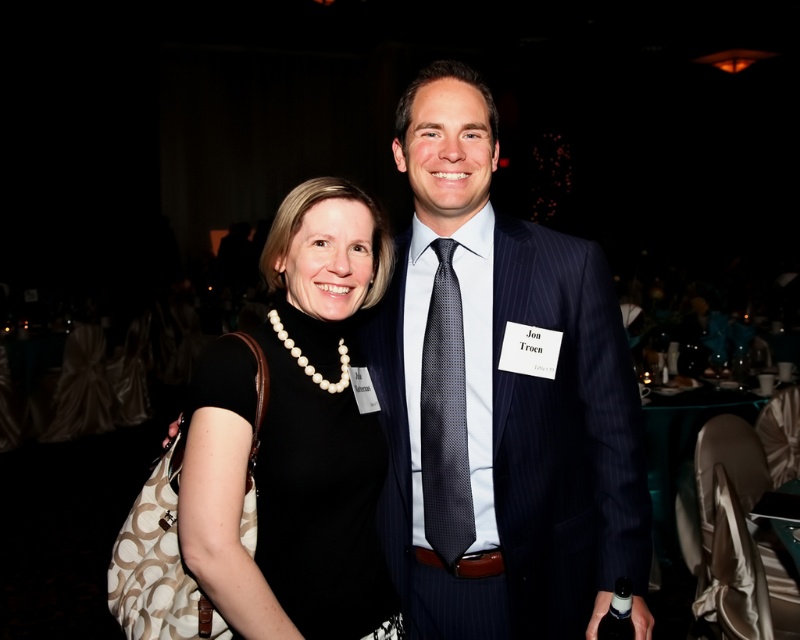
Can you confirm if black matte dress at center is bigger than black dotted tie at center?

Correct, black matte dress at center is larger in size than black dotted tie at center.

Who is higher up, black matte dress at center or black dotted tie at center?

black matte dress at center

Between point (266, 273) and point (444, 371), which one is positioned behind?

Positioned behind is point (444, 371).

Where is `black matte dress at center`? black matte dress at center is located at coordinates (296, 436).

Is dark blue pinstripe suit at center closer to camera compared to black matte dress at center?

No, dark blue pinstripe suit at center is behind black matte dress at center.

Does dark blue pinstripe suit at center appear on the left side of black matte dress at center?

In fact, dark blue pinstripe suit at center is to the right of black matte dress at center.

Is point (496, 144) farther from viewer compared to point (354, 212)?

That is True.

What are the coordinates of `dark blue pinstripe suit at center` in the screenshot? It's located at (498, 397).

Does dark blue pinstripe suit at center appear over black dotted tie at center?

Indeed, dark blue pinstripe suit at center is positioned over black dotted tie at center.

Who is more forward, (450, 481) or (460, 541)?

Point (460, 541) is in front.

Where is `dark blue pinstripe suit at center`? The image size is (800, 640). dark blue pinstripe suit at center is located at coordinates (498, 397).